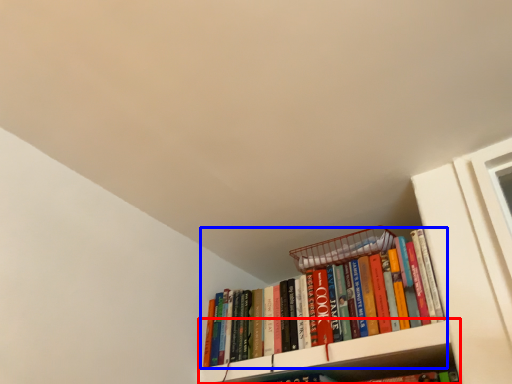
Question: Which object appears farthest to the camera in this image, cabinet (highlighted by a red box) or book (highlighted by a blue box)?

Choices:
 (A) cabinet
 (B) book

Answer: (B)